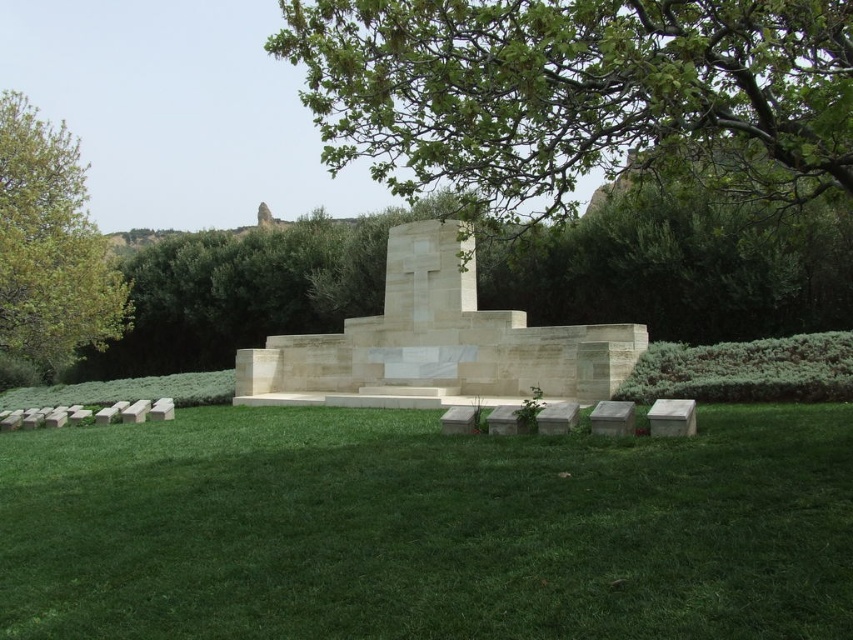
Question: Can you confirm if green leafy tree at upper center is positioned below green leafy tree at left?

Choices:
 (A) no
 (B) yes

Answer: (A)

Question: Does green leafy tree at upper center have a smaller size compared to white stone cross at center?

Choices:
 (A) yes
 (B) no

Answer: (B)

Question: Which point is closer to the camera?

Choices:
 (A) (682, 93)
 (B) (68, 275)
 (C) (721, 406)
 (D) (273, 339)

Answer: (A)

Question: Can you confirm if green grass at lower center is positioned below white stone cross at center?

Choices:
 (A) no
 (B) yes

Answer: (B)

Question: Which is farther from the green leafy tree at upper center?

Choices:
 (A) green leafy tree at left
 (B) green grass at lower center

Answer: (A)

Question: Which of the following is the farthest from the observer?

Choices:
 (A) (447, 282)
 (B) (532, 102)

Answer: (A)